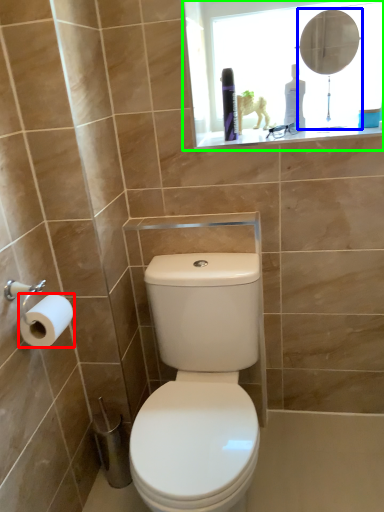
Question: Which is farther away from toilet paper (highlighted by a red box)? mirror (highlighted by a blue box) or medicine cabinet (highlighted by a green box)?

Choices:
 (A) mirror
 (B) medicine cabinet

Answer: (A)